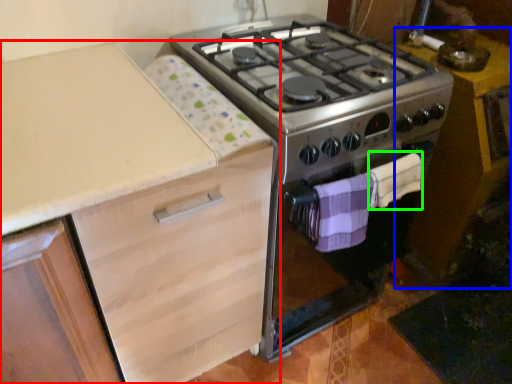
Question: Which object is the closest to the cabinetry (highlighted by a red box)? Choose among these: table (highlighted by a blue box) or blanket (highlighted by a green box).

Choices:
 (A) table
 (B) blanket

Answer: (B)